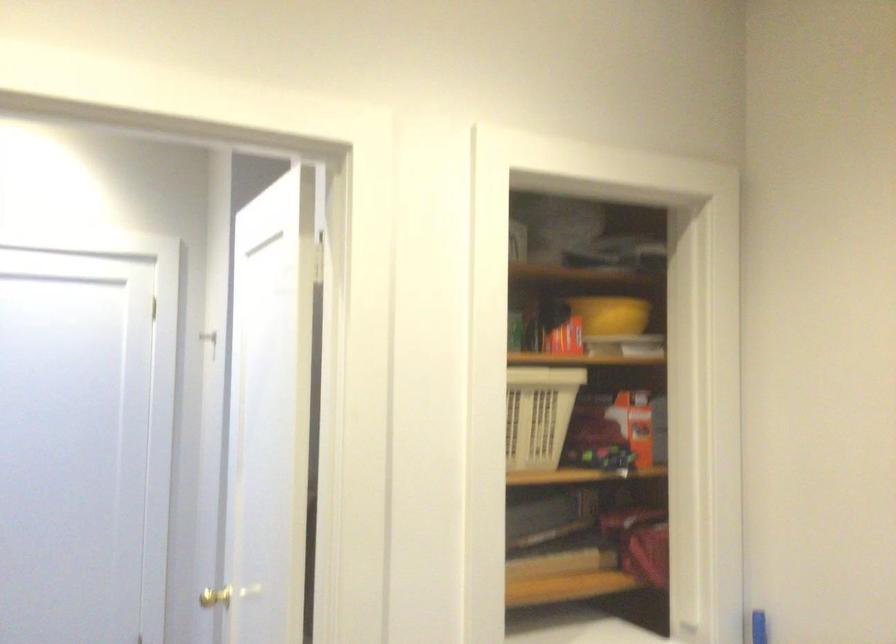
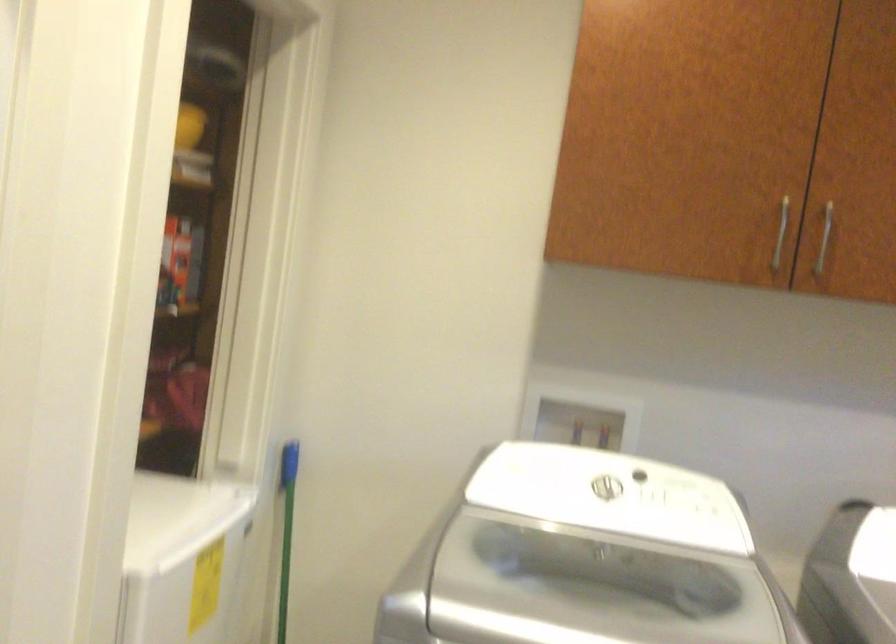
Question: The images are taken continuously from a first-person perspective. In which direction is your viewpoint rotating?

Choices:
 (A) Left
 (B) Right
 (C) Up
 (D) Down

Answer: (B)